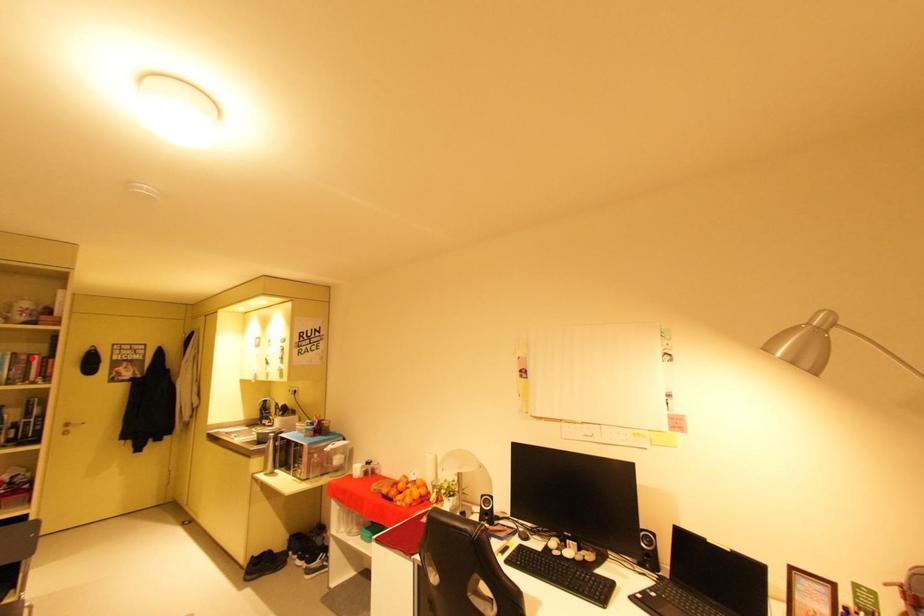
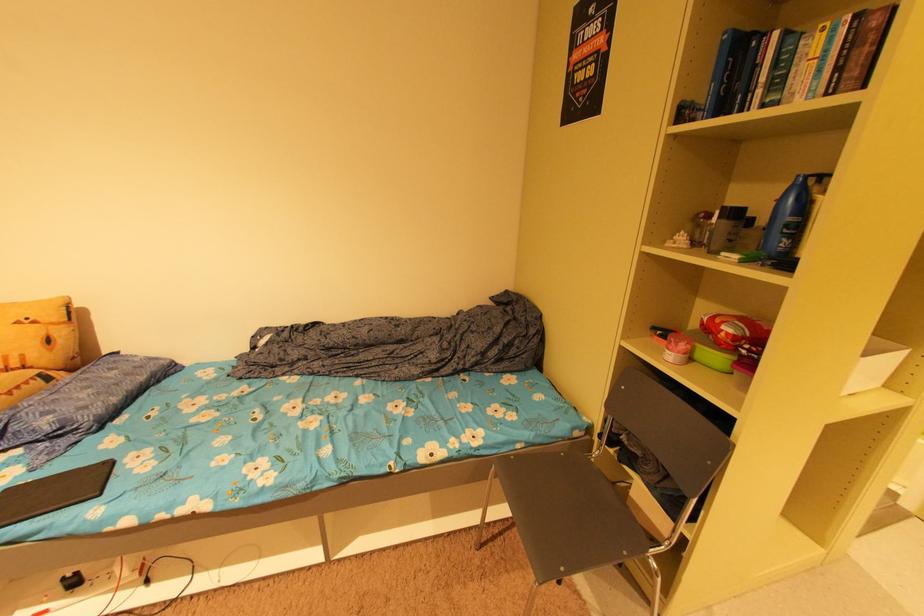
Question: I am providing you with two images of the same scene from different viewpoints. A red point is shown in image1. For the corresponding object point in image2, is it positioned nearer or farther from the camera?

Choices:
 (A) Nearer
 (B) Farther

Answer: (B)